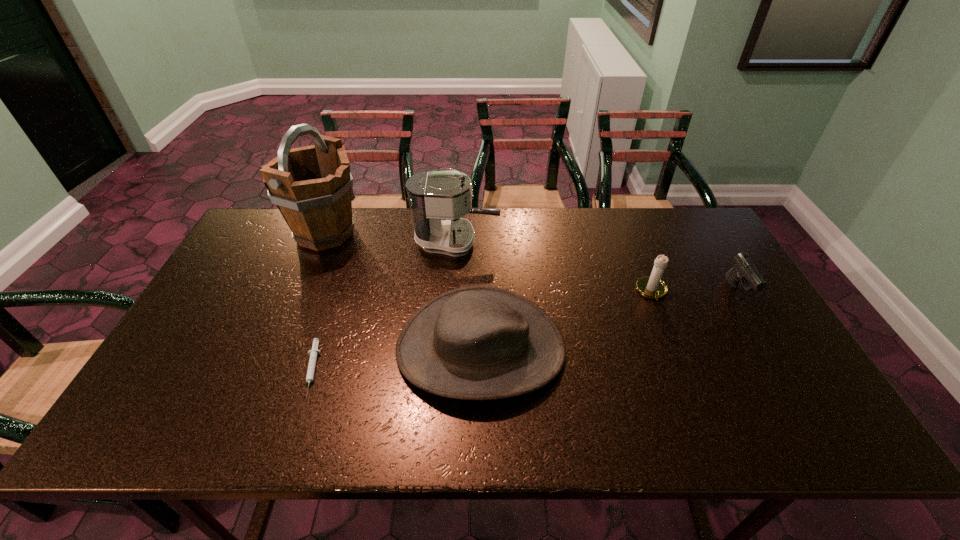
This screenshot has height=540, width=960. What are the coordinates of `vacant space at the near edge of the desktop` in the screenshot? It's located at (249, 430).

Locate an element on the screen. free space at the left edge of the desktop is located at coordinates click(245, 280).

Find the location of a particular element. vacant region at the right edge of the desktop is located at coordinates (798, 377).

Where is `vacant space at the far right corner`? Image resolution: width=960 pixels, height=540 pixels. vacant space at the far right corner is located at coordinates (714, 238).

You are a GUI agent. You are given a task and a screenshot of the screen. Output one action in this format:
    pyautogui.click(x=<x>, y=<y>)
    Task: Click on the free space that is in between the cowboy hat and the fifth tallest object
    This screenshot has height=540, width=960.
    Given the screenshot: What is the action you would take?
    pyautogui.click(x=610, y=320)

Where is `unoccupied area between the bucket and the coffee maker`? The height and width of the screenshot is (540, 960). unoccupied area between the bucket and the coffee maker is located at coordinates (391, 238).

Locate an element on the screen. vacant space in between the candle holder and the cowboy hat is located at coordinates coord(566,320).

At what (x,y) coordinates should I click in order to perform the action: click on unoccupied area between the second tallest object and the second object from right to left. Please return your answer as a coordinate pair (x, y). Looking at the image, I should click on (554, 266).

You are a GUI agent. You are given a task and a screenshot of the screen. Output one action in this format:
    pyautogui.click(x=<x>, y=<y>)
    Task: Click on the empty location between the rightmost object and the tallest object
    This screenshot has width=960, height=540.
    Given the screenshot: What is the action you would take?
    pyautogui.click(x=532, y=262)

Find the location of a particular element. The image size is (960, 540). free point between the shortest object and the fifth shortest object is located at coordinates (384, 306).